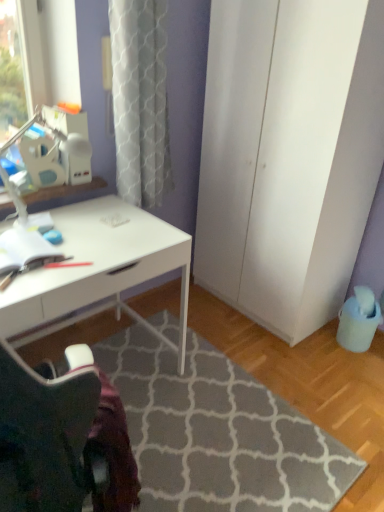
The image size is (384, 512). I want to click on free space in front of white matte cabinet at right, so click(296, 361).